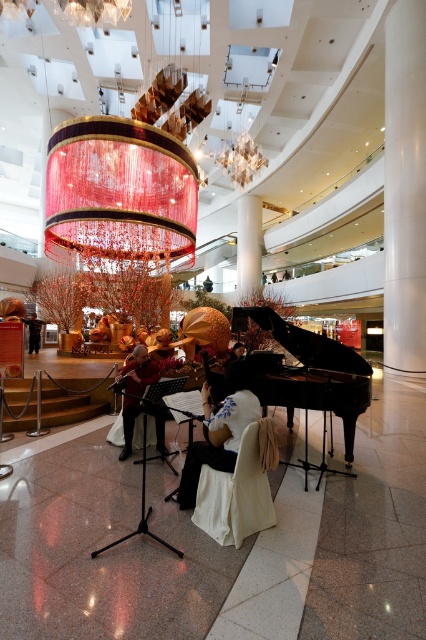
From the picture: Is white satin dress at center positioned at the back of black polished piano at center?

No, white satin dress at center is closer to the viewer.

Does white satin dress at center have a greater width compared to black polished piano at center?

Incorrect, white satin dress at center's width does not surpass black polished piano at center's.

Between point (195, 458) and point (356, 358), which one is positioned behind?

The point (356, 358) is more distant.

Locate an element on the screen. The height and width of the screenshot is (640, 426). white satin dress at center is located at coordinates (219, 429).

Is white satin dress at center below matte red violin at center?

Yes.

Which is above, white satin dress at center or matte red violin at center?

Positioned higher is matte red violin at center.

Is point (215, 413) less distant than point (132, 422)?

Yes.

Identify the location of white satin dress at center. The width and height of the screenshot is (426, 640). (219, 429).

Can you confirm if black polished piano at center is positioned above matte red violin at center?

Yes, black polished piano at center is above matte red violin at center.

Does black polished piano at center have a greater height compared to matte red violin at center?

No.

Does point (347, 419) come farther from viewer compared to point (155, 413)?

No.

Where is `black polished piano at center`? The width and height of the screenshot is (426, 640). black polished piano at center is located at coordinates (302, 340).